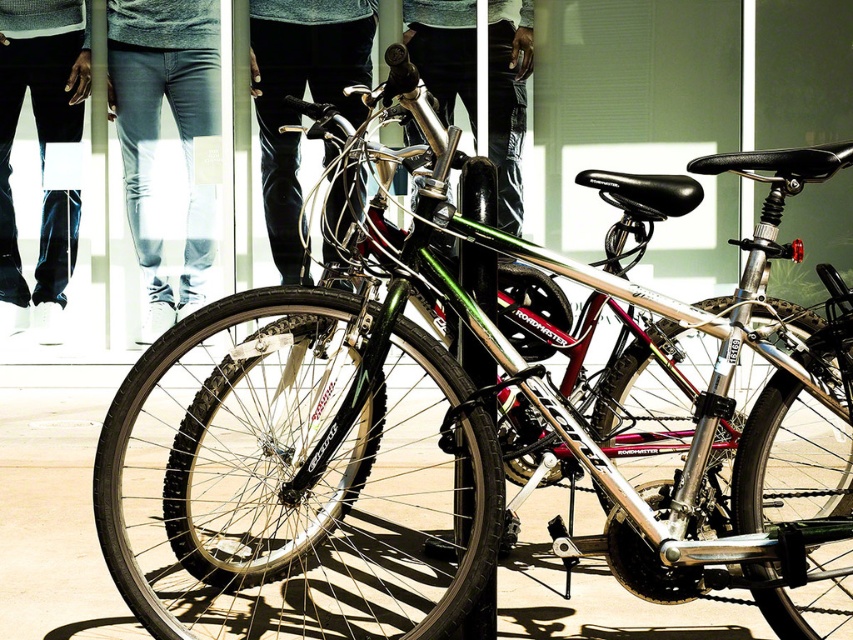
You are trying to decide which pair of jeans to wear. You see a denim jeans at center and a dark blue jeans at lower left in the image. Which one is shorter?

The denim jeans at center is shorter than the dark blue jeans at lower left.

You are standing in a clothing store and see the denim jeans at center and the dark blue jeans at lower left. Which pair of jeans is positioned higher up in the store display?

The dark blue jeans at lower left are positioned higher up in the store display compared to the denim jeans at center, as the denim jeans at center is located below dark blue jeans at lower left.

You are a delivery person who needs to place a package on the smooth concrete pavement at center and denim jeans at center. Which surface can you place the package on without it falling over?

The denim jeans at center are larger than the smooth concrete pavement at center, so placing the package on the denim jeans at center would provide a more stable base to prevent it from falling over.